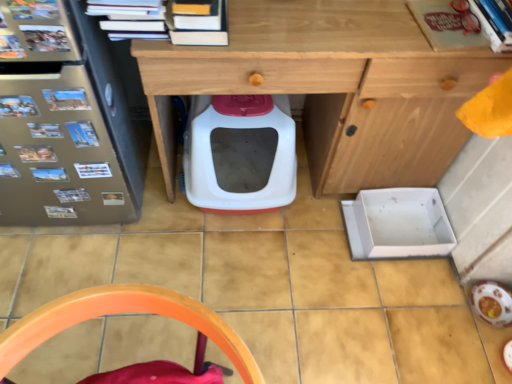
This screenshot has height=384, width=512. I want to click on vacant space in front of wooden desk at center, so click(297, 290).